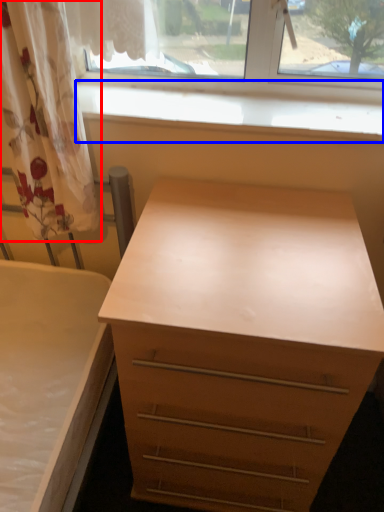
Question: Which point is closer to the camera, curtain (highlighted by a red box) or window sill (highlighted by a blue box)?

Choices:
 (A) curtain
 (B) window sill

Answer: (A)